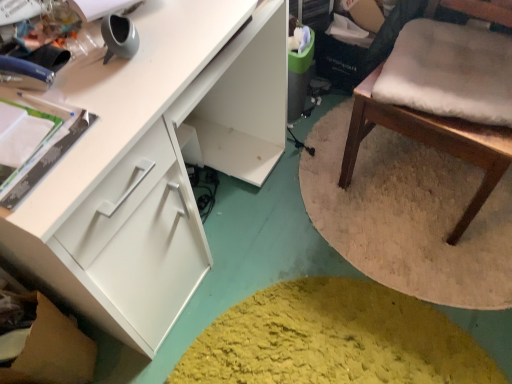
Question: Should I look upward or downward to see white matte cabinet at left?

Choices:
 (A) up
 (B) down

Answer: (A)

Question: Considering the relative positions of white matte cabinet at left and wooden chair with white cushion at right in the image provided, is white matte cabinet at left to the left of wooden chair with white cushion at right from the viewer's perspective?

Choices:
 (A) yes
 (B) no

Answer: (A)

Question: Could you tell me if white matte cabinet at left is turned towards wooden chair with white cushion at right?

Choices:
 (A) yes
 (B) no

Answer: (A)

Question: Considering the relative sizes of white matte cabinet at left and wooden chair with white cushion at right in the image provided, is white matte cabinet at left bigger than wooden chair with white cushion at right?

Choices:
 (A) no
 (B) yes

Answer: (B)

Question: Is white matte cabinet at left not close to wooden chair with white cushion at right?

Choices:
 (A) no
 (B) yes

Answer: (A)

Question: From a real-world perspective, is white matte cabinet at left physically below wooden chair with white cushion at right?

Choices:
 (A) no
 (B) yes

Answer: (B)

Question: Is white matte cabinet at left looking in the opposite direction of wooden chair with white cushion at right?

Choices:
 (A) no
 (B) yes

Answer: (A)

Question: Can you confirm if wooden chair with white cushion at right is shorter than white matte cabinet at left?

Choices:
 (A) yes
 (B) no

Answer: (B)

Question: Is wooden chair with white cushion at right directly adjacent to white matte cabinet at left?

Choices:
 (A) yes
 (B) no

Answer: (B)

Question: Can you confirm if wooden chair with white cushion at right is taller than white matte cabinet at left?

Choices:
 (A) yes
 (B) no

Answer: (A)

Question: Can you confirm if wooden chair with white cushion at right is thinner than white matte cabinet at left?

Choices:
 (A) no
 (B) yes

Answer: (B)

Question: Is wooden chair with white cushion at right at the left side of white matte cabinet at left?

Choices:
 (A) yes
 (B) no

Answer: (B)

Question: Is wooden chair with white cushion at right located outside white matte cabinet at left?

Choices:
 (A) no
 (B) yes

Answer: (B)

Question: From a real-world perspective, is white matte cabinet at left positioned above or below wooden chair with white cushion at right?

Choices:
 (A) above
 (B) below

Answer: (B)